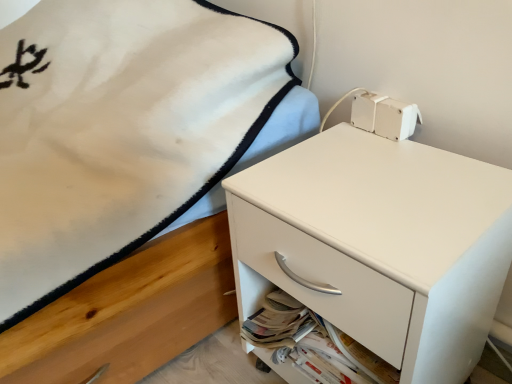
This screenshot has height=384, width=512. Find the location of `blank space situated above white matte chest of drawers at center (from a real-world perspective)`. blank space situated above white matte chest of drawers at center (from a real-world perspective) is located at coordinates (371, 184).